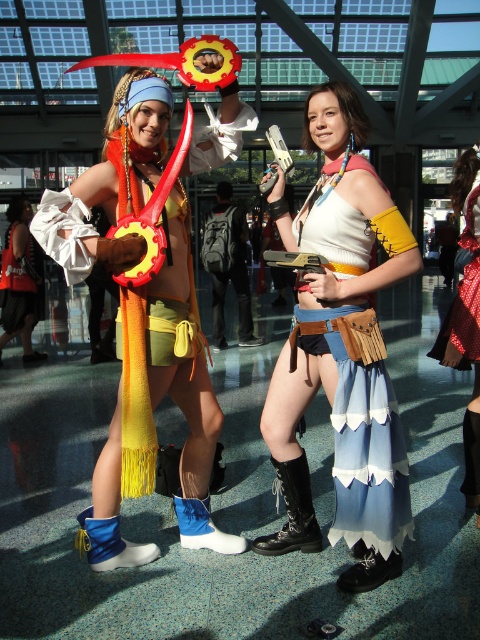
Who is positioned more to the left, matte white skirt at center or blue suede boot at lower center?

From the viewer's perspective, blue suede boot at lower center appears more on the left side.

At what (x,y) coordinates should I click in order to perform the action: click on matte white skirt at center. Please return your answer as a coordinate pair (x, y). Image resolution: width=480 pixels, height=640 pixels. Looking at the image, I should click on (340, 352).

Is point (349, 140) less distant than point (179, 493)?

Yes, point (349, 140) is closer to viewer.

Identify the location of matte white skirt at center. Image resolution: width=480 pixels, height=640 pixels. (340, 352).

Is matte white skirt at center positioned at the back of yellow fringed scarf at left?

No, it is in front of yellow fringed scarf at left.

Who is more forward, (x=404, y=256) or (x=13, y=332)?

Positioned in front is point (x=404, y=256).

Is point (262, 536) farther from camera compared to point (24, 308)?

No, (262, 536) is closer to viewer.

The image size is (480, 640). What are the coordinates of `matte white skirt at center` in the screenshot? It's located at (340, 352).

Is silky red dress at center bigger than velvet red dress at center?

Yes, silky red dress at center is bigger than velvet red dress at center.

Between point (466, 456) and point (463, 333), which one is positioned in front?

Positioned in front is point (463, 333).

Find the location of `silky red dress at center`. silky red dress at center is located at coordinates (466, 316).